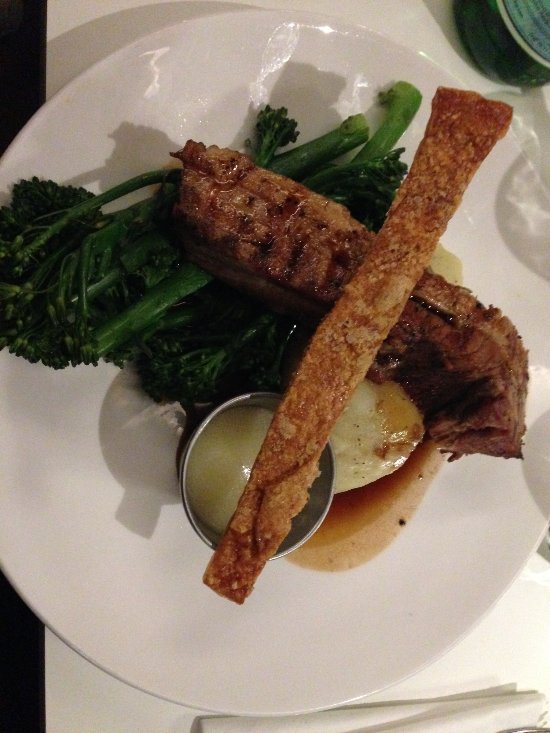
At what (x,y) coordinates should I click in order to perform the action: click on tablecloth. Please return your answer as a coordinate pair (x, y). This screenshot has width=550, height=733. Looking at the image, I should click on (504, 648).